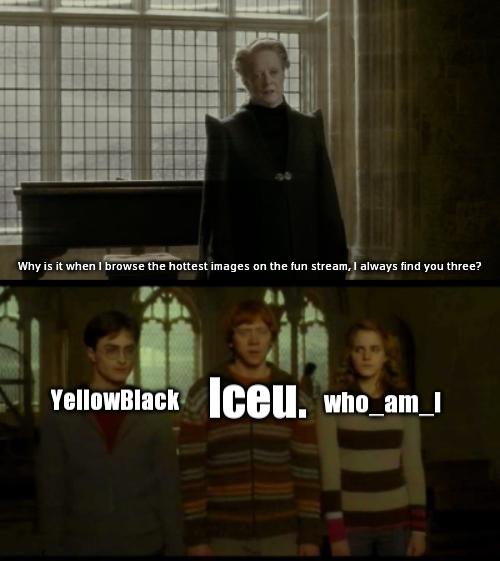
Locate an element on the screen. robe is located at coordinates (299, 149).